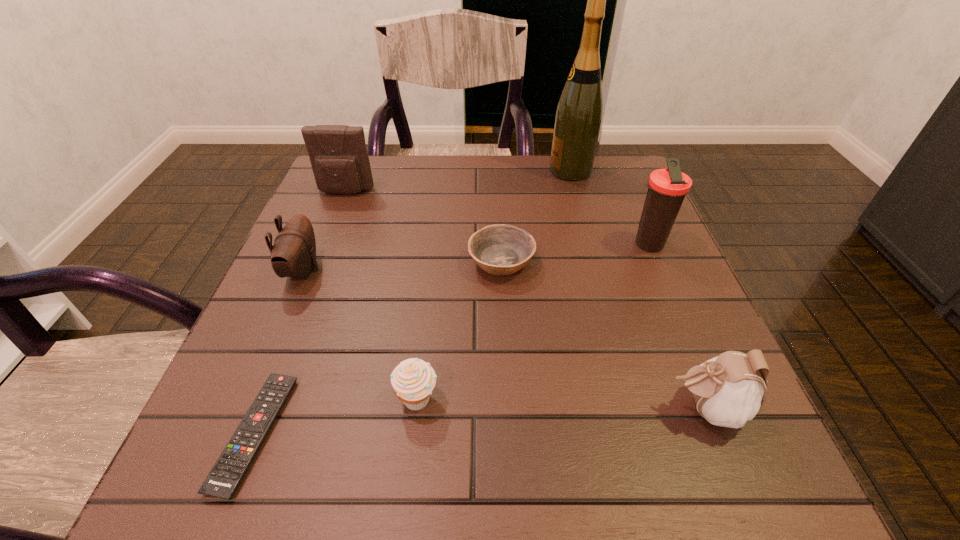
Where is `free space at the near right corner of the desktop`? This screenshot has width=960, height=540. free space at the near right corner of the desktop is located at coordinates (650, 442).

I want to click on free spot between the tallest object and the farthest pouch, so click(x=458, y=181).

The height and width of the screenshot is (540, 960). I want to click on free space between the fifth object from right to left and the wine bottle, so click(494, 285).

You are a GUI agent. You are given a task and a screenshot of the screen. Output one action in this format:
    pyautogui.click(x=<x>, y=<y>)
    Task: Click on the free spot between the remote control and the bowl
    The width and height of the screenshot is (960, 540).
    Given the screenshot: What is the action you would take?
    click(378, 347)

This screenshot has width=960, height=540. Find the location of `vacant region between the thermos bottle and the farthest object`. vacant region between the thermos bottle and the farthest object is located at coordinates (609, 207).

The width and height of the screenshot is (960, 540). Find the location of `free space between the second farthest object and the muffin`. free space between the second farthest object and the muffin is located at coordinates 381,295.

Identify the location of empty location between the shortest object and the farthest object. (413, 302).

Where is `vacant area that lies between the second farthest pouch and the bowl`? This screenshot has width=960, height=540. vacant area that lies between the second farthest pouch and the bowl is located at coordinates (402, 266).

Image resolution: width=960 pixels, height=540 pixels. Identify the location of vacant space in between the remote control and the nearest pouch. (480, 421).

This screenshot has height=540, width=960. Find the location of `vacant space that's between the sixth tallest object and the wine bottle`. vacant space that's between the sixth tallest object and the wine bottle is located at coordinates (494, 285).